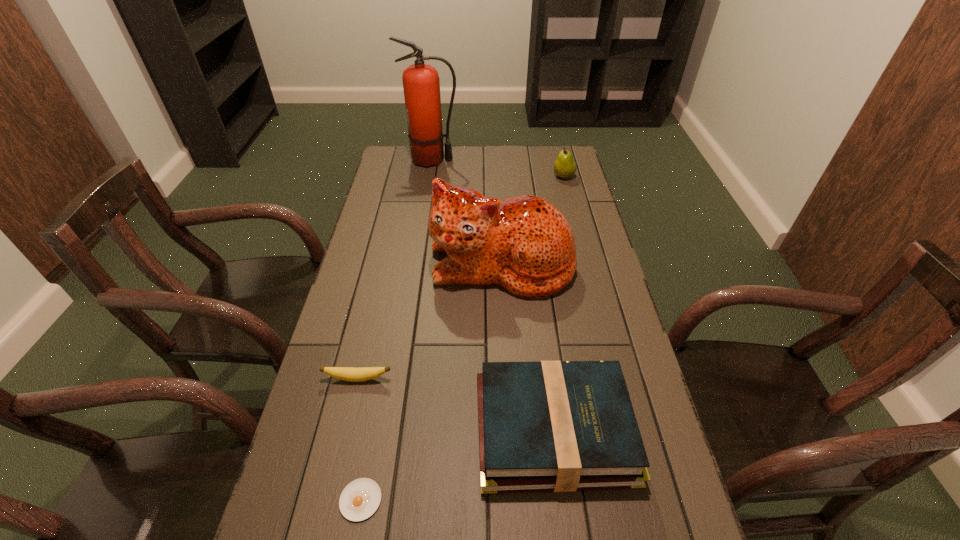
Find the location of `cat that is at the right edge`. cat that is at the right edge is located at coordinates (524, 244).

The image size is (960, 540). What are the coordinates of `pear at the right edge` in the screenshot? It's located at (564, 167).

I want to click on hardback book positioned at the right edge, so click(x=563, y=426).

Image resolution: width=960 pixels, height=540 pixels. I want to click on object present at the far left corner, so click(x=421, y=84).

Find the location of a particular element. The height and width of the screenshot is (540, 960). object at the far right corner is located at coordinates (564, 167).

Locate an element on the screen. This screenshot has height=540, width=960. free space at the far edge of the desktop is located at coordinates (534, 162).

Find the location of a particular element. Image resolution: width=960 pixels, height=540 pixels. blank space at the left edge is located at coordinates (384, 244).

Identify the location of free space at the right edge. Image resolution: width=960 pixels, height=540 pixels. tap(551, 187).

I want to click on free space at the far right corner of the desktop, so click(552, 168).

Identify the location of free point between the fifth nearest object and the tallest object. (497, 168).